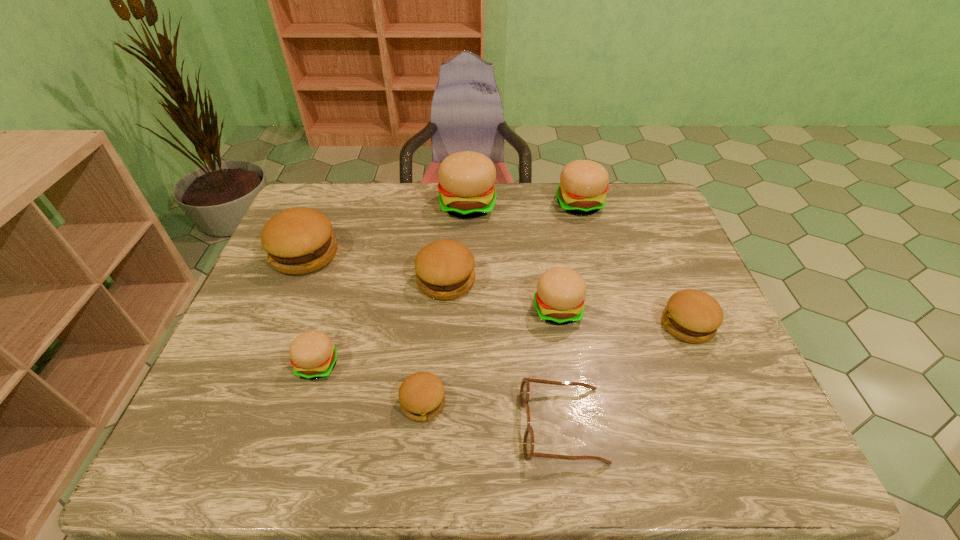
Identify the location of blank space at the right edge. (664, 249).

You are a GUI agent. You are given a task and a screenshot of the screen. Output one action in this format:
    pyautogui.click(x=<x>, y=<y>)
    Task: Click on the free region at the far right corner
    The height and width of the screenshot is (540, 960).
    Given the screenshot: What is the action you would take?
    pyautogui.click(x=619, y=206)

Where is `vacant area at the near right corner of the desktop`? Image resolution: width=960 pixels, height=540 pixels. vacant area at the near right corner of the desktop is located at coordinates (712, 429).

You are a GUI agent. You are given a task and a screenshot of the screen. Output one action in this format:
    pyautogui.click(x=<x>, y=<y>)
    Task: Click on the unoccupied area between the leftmost beige hamburger and the nearest brown hamburger
    
    Given the screenshot: What is the action you would take?
    pyautogui.click(x=371, y=383)

The height and width of the screenshot is (540, 960). Find the location of `free space that is in between the shortest hamburger and the second biggest beige hamburger`. free space that is in between the shortest hamburger and the second biggest beige hamburger is located at coordinates (501, 303).

Image resolution: width=960 pixels, height=540 pixels. Find the location of `unoccupied position between the leftmost beige hamburger and the nearest brown hamburger`. unoccupied position between the leftmost beige hamburger and the nearest brown hamburger is located at coordinates (371, 383).

This screenshot has width=960, height=540. I want to click on free space between the nearest brown hamburger and the second smallest beige hamburger, so click(x=491, y=356).

The image size is (960, 540). I want to click on empty space between the tallest object and the shortest hamburger, so click(445, 304).

You are a GUI agent. You are given a task and a screenshot of the screen. Output one action in this format:
    pyautogui.click(x=<x>, y=<y>)
    Task: Click on the vacant area that lies between the second biggest beige hamburger and the smallest brown hamburger
    
    Given the screenshot: What is the action you would take?
    pyautogui.click(x=501, y=303)

Identify the location of vacant area that lies between the rightmost hamburger and the biggest brown hamburger. (496, 289).